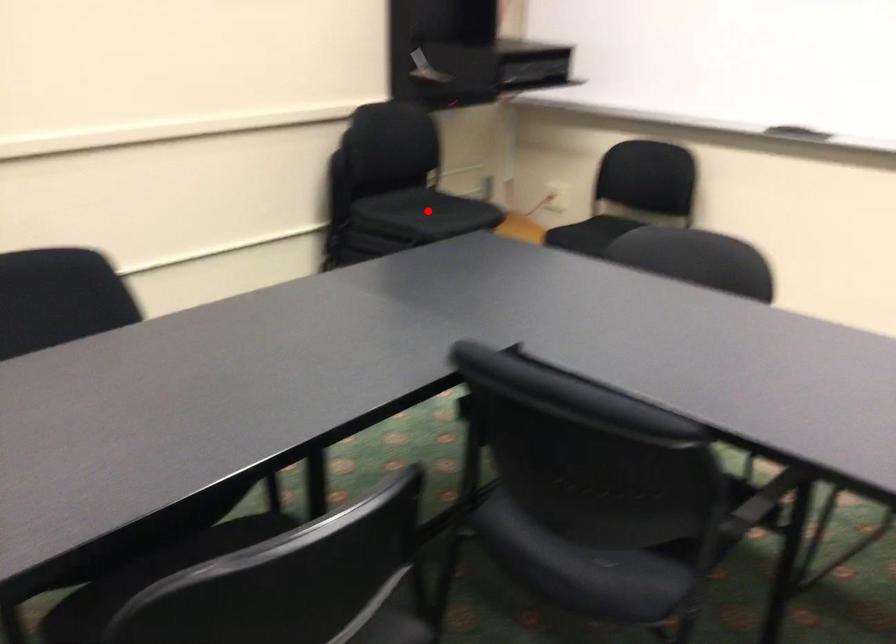
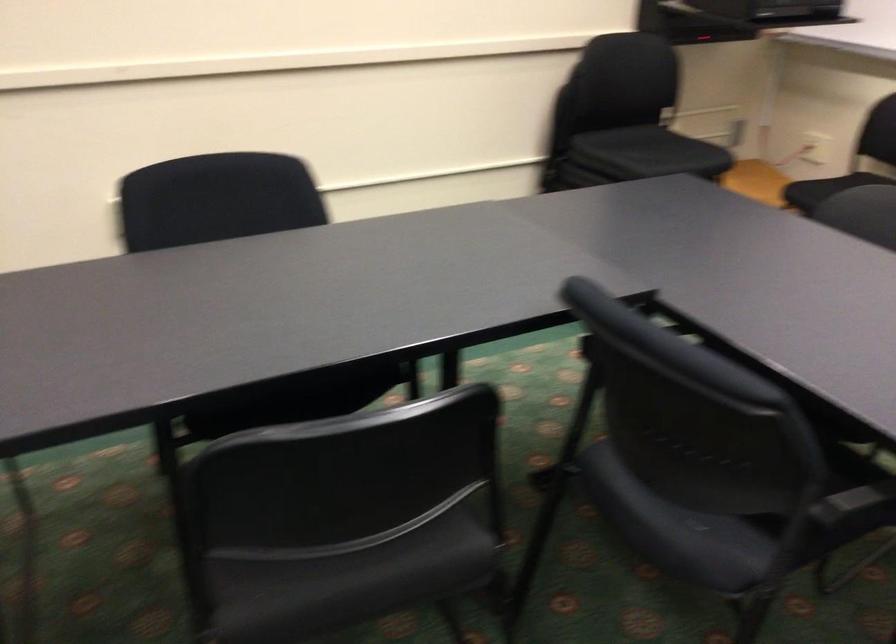
In the second image, find the point that corresponds to the highlighted location in the first image.

(650, 152)